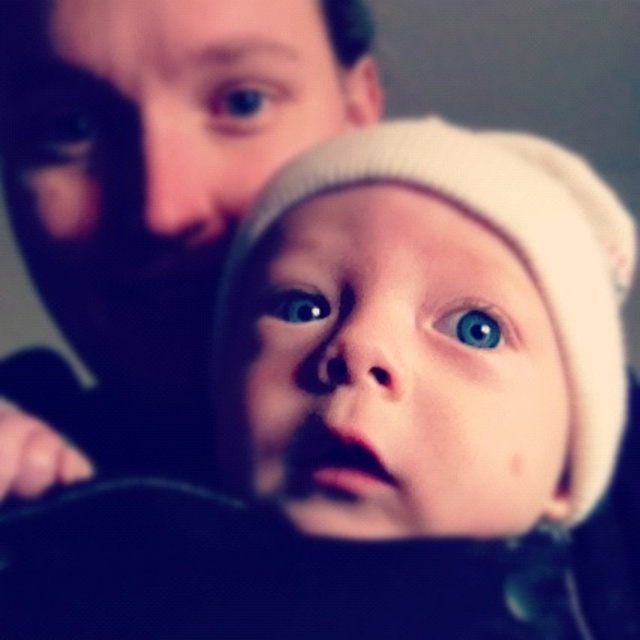
You are a photographer adjusting the focus on a camera. You notice two blue matte eyes in the scene. Which blue matte eye is closer to you, the blue matte eye at upper center or the blue matte eye at center?

The blue matte eye at upper center is closer to you because it is further to the viewer than the blue matte eye at center.

Based on the scene description, which object, the matte black eye at upper left or the blue matte eye at center, is wider?

The matte black eye at upper left might be wider than blue matte eye at center according to the description.

You are a photographer reviewing a portrait. The image has two eyes visible in the scene. The first is the matte black eye at upper left and the second is the blue matte eye at center. Which of these eyes appears bigger in the photo?

The matte black eye at upper left is larger in size than the blue matte eye at center, so the matte black eye at upper left appears bigger in the photo.